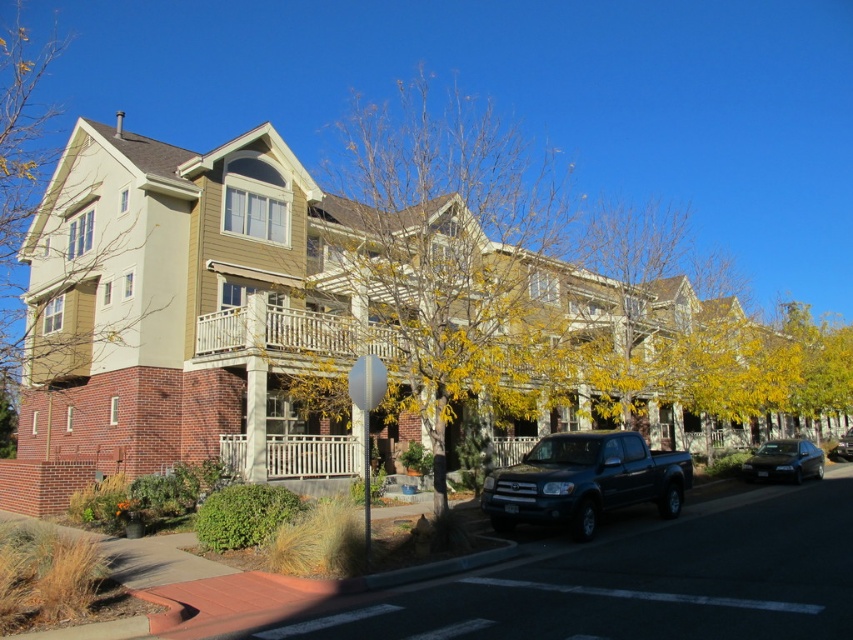
Question: Which object appears farthest from the camera in this image?

Choices:
 (A) black rubber line at lower center
 (B) white painted wood porch at upper center
 (C) white painted line at center
 (D) white plastic line at lower center

Answer: (B)

Question: Which object is the farthest from the yellow leafy tree at center?

Choices:
 (A) shiny black sedan at lower right
 (B) shiny black truck at center
 (C) white plastic line at lower center
 (D) white painted line at center

Answer: (B)

Question: Is matte dark blue truck at center below yellow leafy tree at upper center?

Choices:
 (A) yes
 (B) no

Answer: (A)

Question: Does matte dark blue truck at center appear under shiny black truck at center?

Choices:
 (A) no
 (B) yes

Answer: (A)

Question: Can you confirm if yellow leafy tree at center is positioned above black rubber line at lower center?

Choices:
 (A) no
 (B) yes

Answer: (B)

Question: Which object is the farthest from the black rubber line at lower center?

Choices:
 (A) yellow leafy tree at upper center
 (B) shiny black truck at center

Answer: (B)